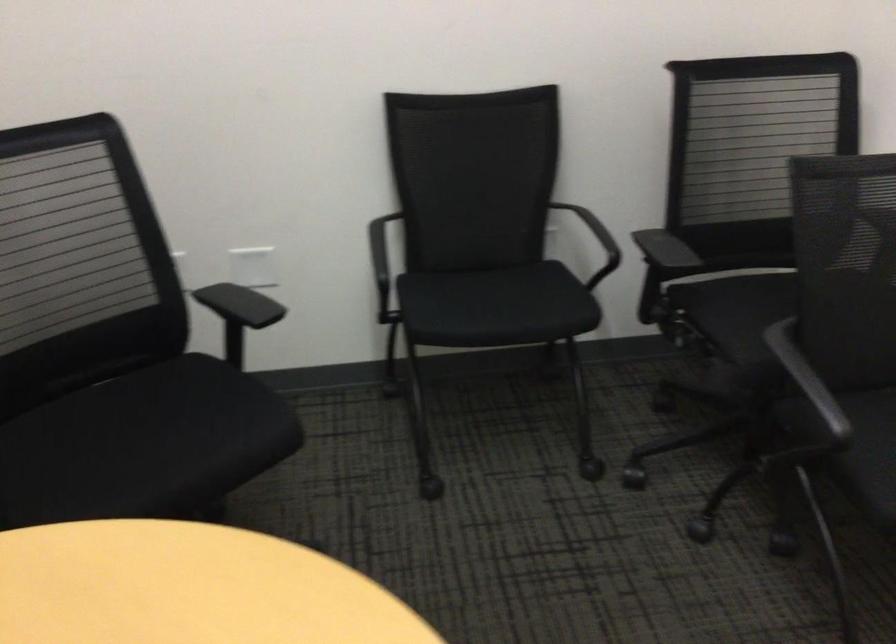
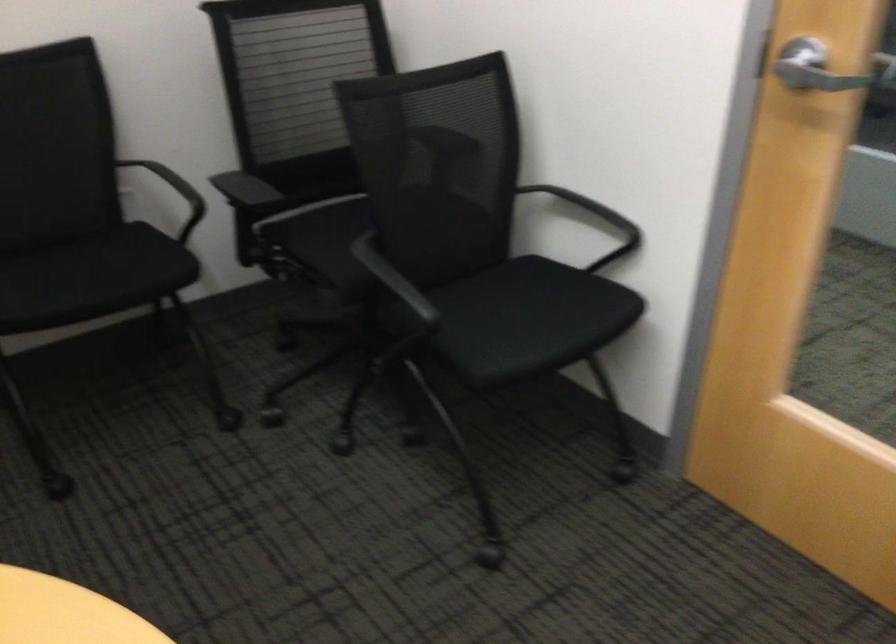
Question: The images are taken continuously from a first-person perspective. In which direction is your viewpoint rotating?

Choices:
 (A) Left
 (B) Right
 (C) Up
 (D) Down

Answer: (B)